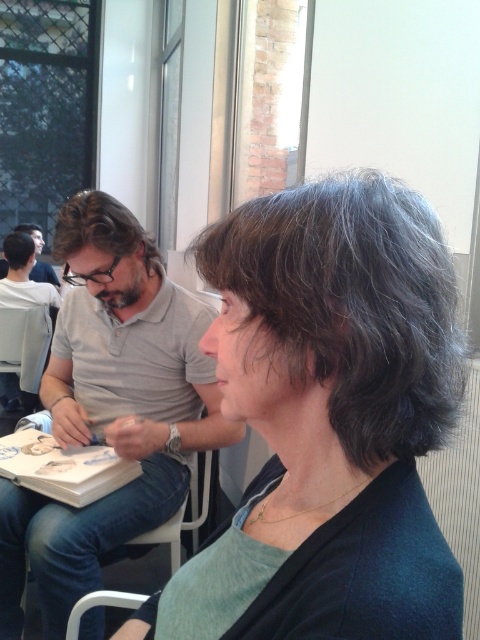
Between gray matte hair at center and white shirt at left, which one has more height?

gray matte hair at center is taller.

Who is lower down, gray matte hair at center or white shirt at left?

gray matte hair at center

Where is `gray matte hair at center`? The width and height of the screenshot is (480, 640). gray matte hair at center is located at coordinates (335, 406).

Identify the location of gray matte hair at center. (335, 406).

Who is positioned more to the right, gray matte hair at center or white plastic chair at lower left?

From the viewer's perspective, gray matte hair at center appears more on the right side.

Where is `gray matte hair at center`? The height and width of the screenshot is (640, 480). gray matte hair at center is located at coordinates (335, 406).

Who is shorter, gray matte hair at center or dark brown hair at left?

dark brown hair at left is shorter.

What do you see at coordinates (335, 406) in the screenshot? This screenshot has width=480, height=640. I see `gray matte hair at center` at bounding box center [335, 406].

Is point (243, 614) in front of point (15, 268)?

Yes.

The width and height of the screenshot is (480, 640). Identify the location of gray matte hair at center. (335, 406).